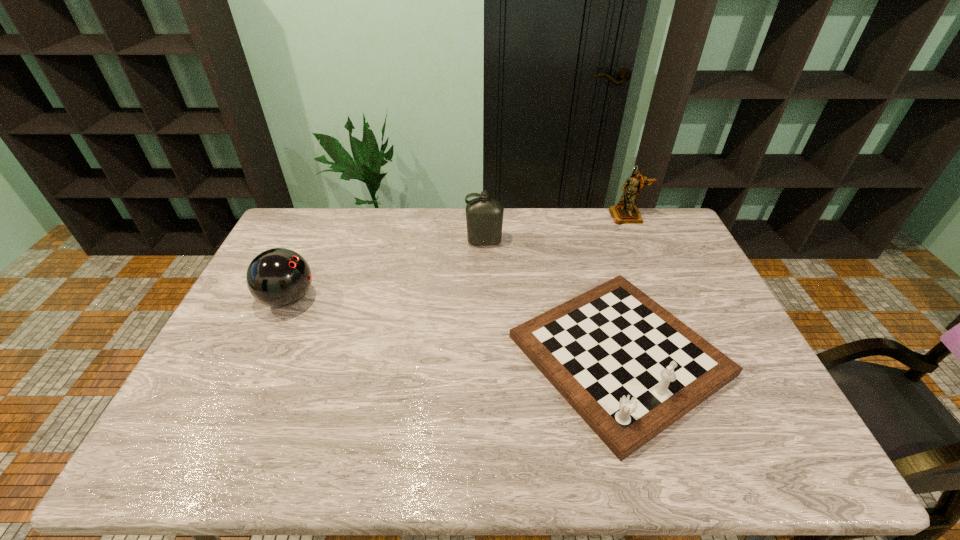
Where is `free point at the right edge`? free point at the right edge is located at coordinates (689, 280).

Image resolution: width=960 pixels, height=540 pixels. What are the coordinates of `vacant region at the far right corner` in the screenshot? It's located at (680, 230).

At what (x,y) coordinates should I click in order to perform the action: click on vacant area at the near right corner. Please return your answer as a coordinate pair (x, y). Looking at the image, I should click on (744, 449).

You are a GUI agent. You are given a task and a screenshot of the screen. Output one action in this format:
    pyautogui.click(x=<x>, y=<y>)
    Task: Click on the blank region between the second object from left to right and the shortest object
    The width and height of the screenshot is (960, 540).
    Given the screenshot: What is the action you would take?
    pyautogui.click(x=552, y=299)

Where is `free space between the second farthest object and the third tallest object`? The height and width of the screenshot is (540, 960). free space between the second farthest object and the third tallest object is located at coordinates (386, 271).

Identify the location of free spot between the second shortest object and the figurine. (458, 258).

Find the location of a particular element. Image resolution: width=960 pixels, height=540 pixels. vacant space in between the bowling ball and the gameboard is located at coordinates (454, 327).

You are a GUI agent. You are given a task and a screenshot of the screen. Output one action in this format:
    pyautogui.click(x=<x>, y=<y>)
    Task: Click on the blank region between the leftmost object and the third object from right to left
    This screenshot has height=540, width=960.
    Given the screenshot: What is the action you would take?
    pyautogui.click(x=386, y=271)

You are a GUI agent. You are given a task and a screenshot of the screen. Output one action in this format:
    pyautogui.click(x=<x>, y=<y>)
    Task: Click on the free area in between the farthest object and the third object from right to left
    Image resolution: width=960 pixels, height=540 pixels.
    Given the screenshot: What is the action you would take?
    pyautogui.click(x=556, y=229)

This screenshot has height=540, width=960. Identify the location of free area in between the second object from left to right and the bowling ball. (386, 271).